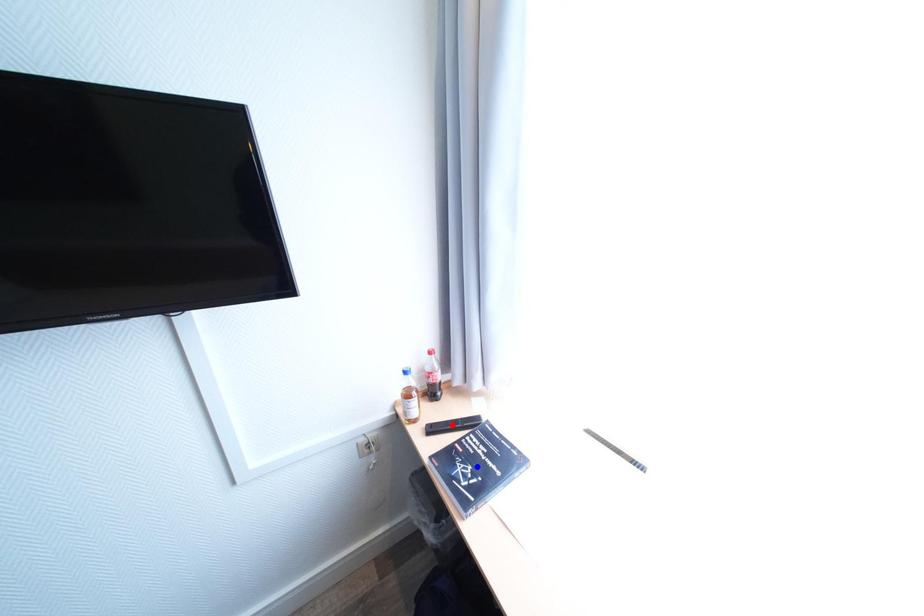
Question: Two points are marked on the image. Which point is closer to the camera?

Choices:
 (A) Blue point is closer.
 (B) Red point is closer.

Answer: (A)